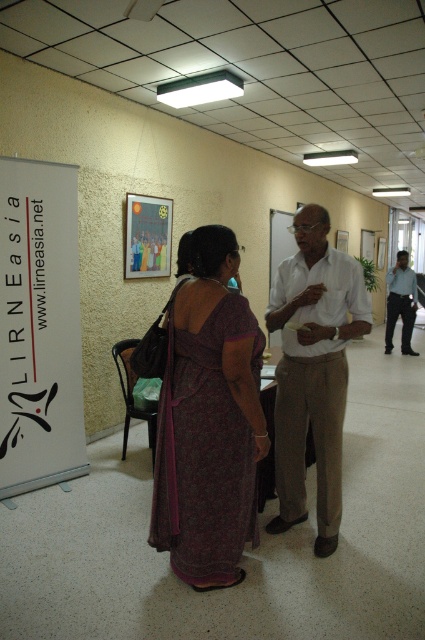
What is located at the coordinates point (39, 326) in the image?

The point (39, 326) indicates white paper at left.

You are standing in the hallway and see two people talking. One is wearing a purple printed saree at center and the other a blue shirt at center. Which clothing item is on the left side?

The purple printed saree at center is positioned on the left side of the blue shirt at center, so the purple printed saree at center is on the left.

In the image, there is a point marked at coordinates [209,420]. Based on the scene description, what object is located at this point?

The point at [209,420] indicates the location of the purple printed saree at center.